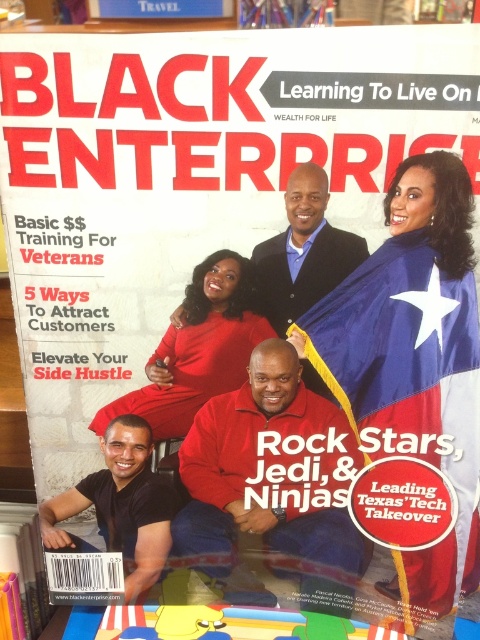
Question: Estimate the real-world distances between objects in this image. Which object is farther from the red matte sweater at center?

Choices:
 (A) red matte dress at center
 (B) smooth black suit at center
 (C) blueflag at right
 (D) black matte shirt at lower left

Answer: (B)

Question: Does red matte sweater at center appear on the left side of smooth black suit at center?

Choices:
 (A) yes
 (B) no

Answer: (B)

Question: Which point appears closest to the camera in this image?

Choices:
 (A) (38, 513)
 (B) (414, 332)
 (C) (344, 419)
 (D) (180, 396)

Answer: (B)

Question: Does blueflag at right appear on the right side of red matte dress at center?

Choices:
 (A) yes
 (B) no

Answer: (A)

Question: Which object is closer to the camera taking this photo?

Choices:
 (A) smooth black suit at center
 (B) black matte shirt at lower left

Answer: (A)

Question: Where is blueflag at right located in relation to red matte sweater at center in the image?

Choices:
 (A) left
 (B) right

Answer: (B)